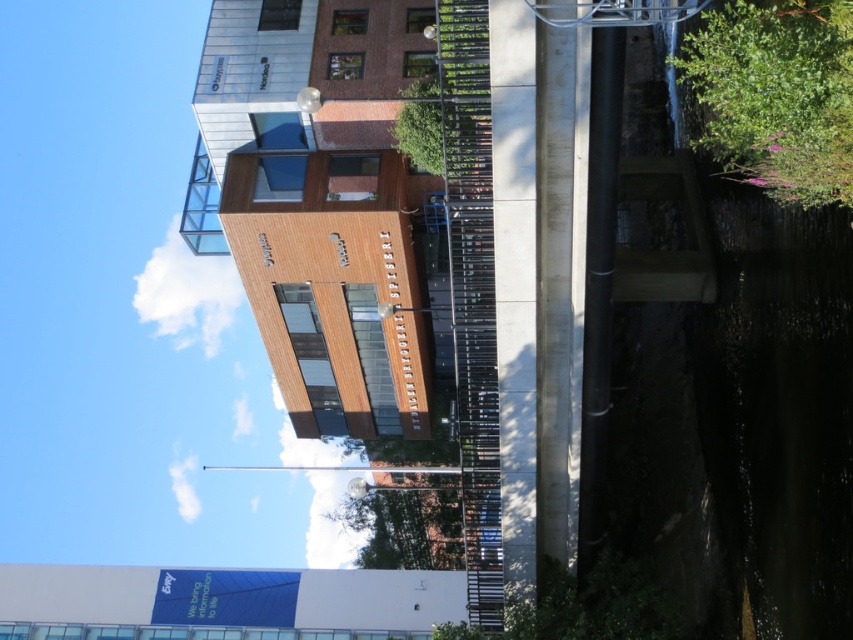
Which is more to the left, green leafy tree at upper center or green leafy tree at center?

From the viewer's perspective, green leafy tree at center appears more on the left side.

Is green leafy tree at upper center thinner than green leafy tree at center?

Correct, green leafy tree at upper center's width is less than green leafy tree at center's.

Locate an element on the screen. green leafy tree at upper center is located at coordinates (451, 100).

Where is `green leafy tree at upper center`? The height and width of the screenshot is (640, 853). green leafy tree at upper center is located at coordinates (451, 100).

Measure the distance between green leafy bush at upper right and green leafy tree at center.

green leafy bush at upper right and green leafy tree at center are 20.12 meters apart.

Is green leafy bush at upper right taller than green leafy tree at center?

No, green leafy bush at upper right is not taller than green leafy tree at center.

Is point (782, 54) farther from camera compared to point (440, 513)?

No, (782, 54) is in front of (440, 513).

Identify the location of green leafy bush at upper right. (776, 93).

The width and height of the screenshot is (853, 640). In order to click on green leafy bush at upper right in this screenshot , I will do `click(776, 93)`.

Who is positioned more to the left, green leafy bush at upper right or green leafy tree at upper center?

green leafy tree at upper center

What do you see at coordinates (776, 93) in the screenshot? I see `green leafy bush at upper right` at bounding box center [776, 93].

Locate an element on the screen. The height and width of the screenshot is (640, 853). green leafy bush at upper right is located at coordinates (776, 93).